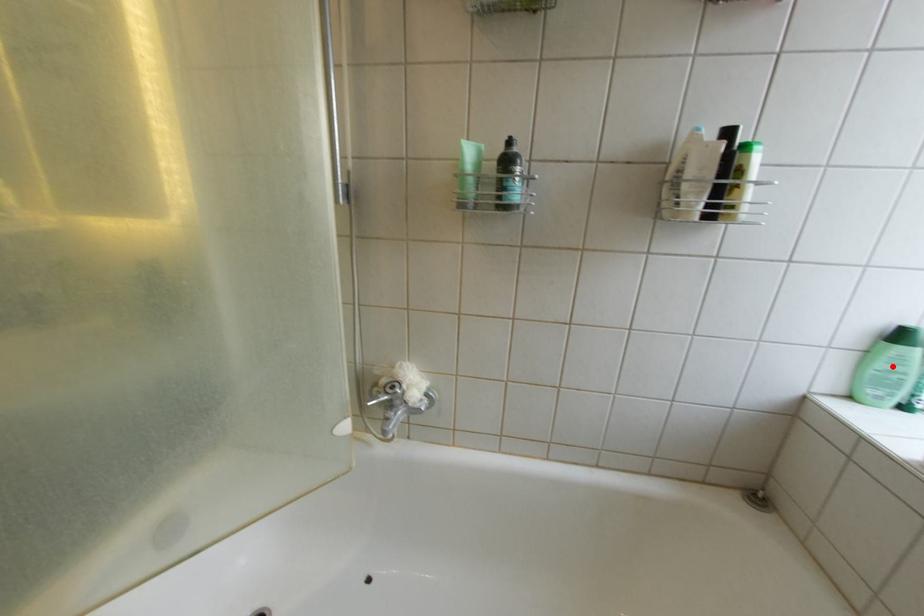
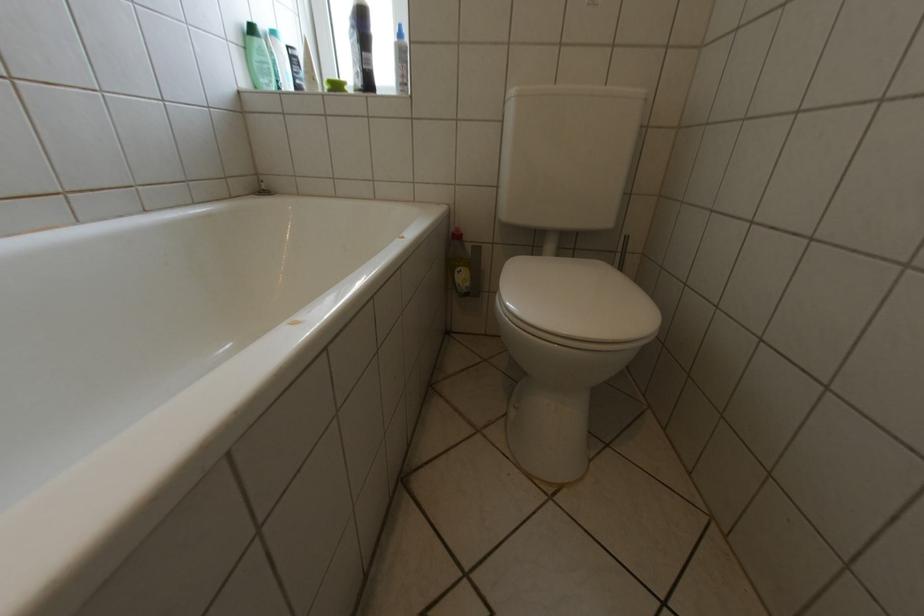
Locate, in the second image, the point that corresponds to the highlighted location in the first image.

(268, 59)